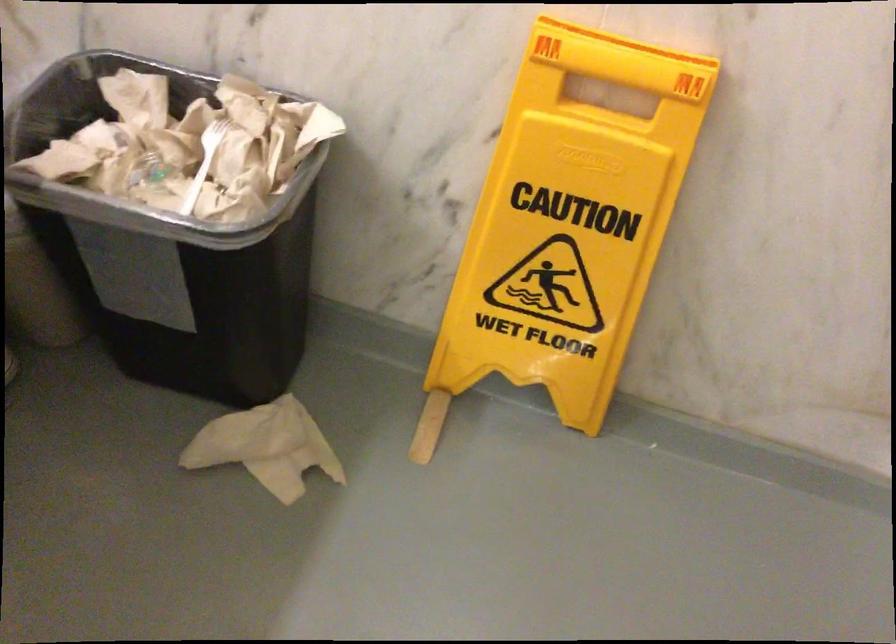
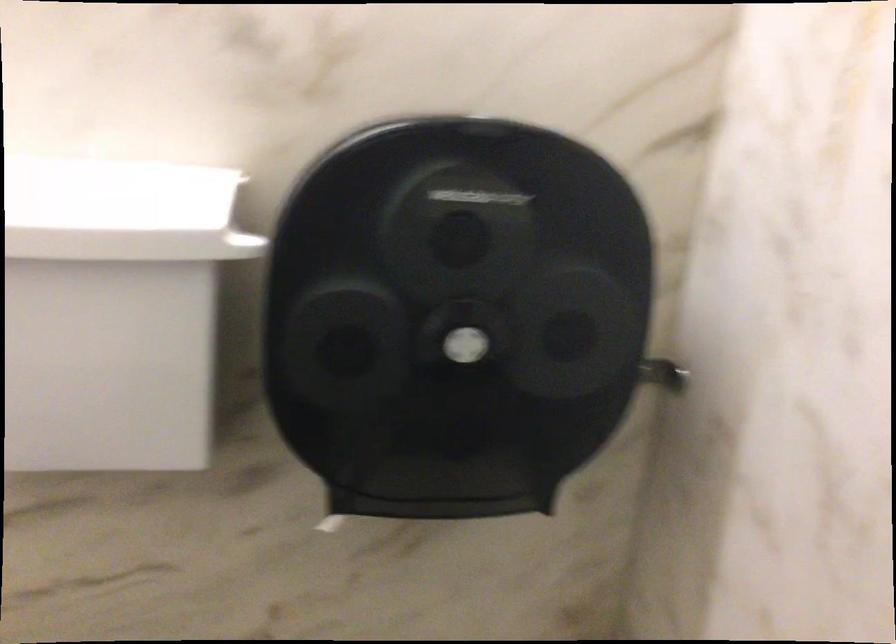
Question: The images are taken continuously from a first-person perspective. In which direction is your viewpoint rotating?

Choices:
 (A) Left
 (B) Right
 (C) Up
 (D) Down

Answer: (A)